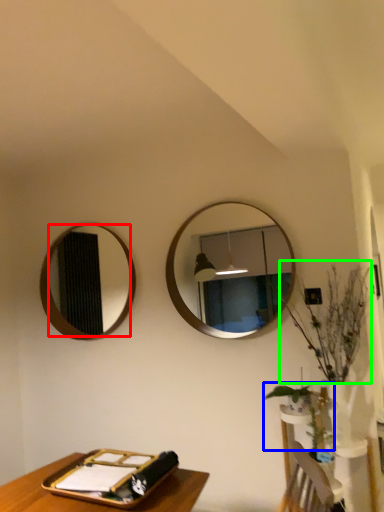
Question: Estimate the real-world distances between objects in this image. Which object is farther from mirror (highlighted by a red box), plant (highlighted by a blue box) or floral arrangement (highlighted by a green box)?

Choices:
 (A) plant
 (B) floral arrangement

Answer: (B)